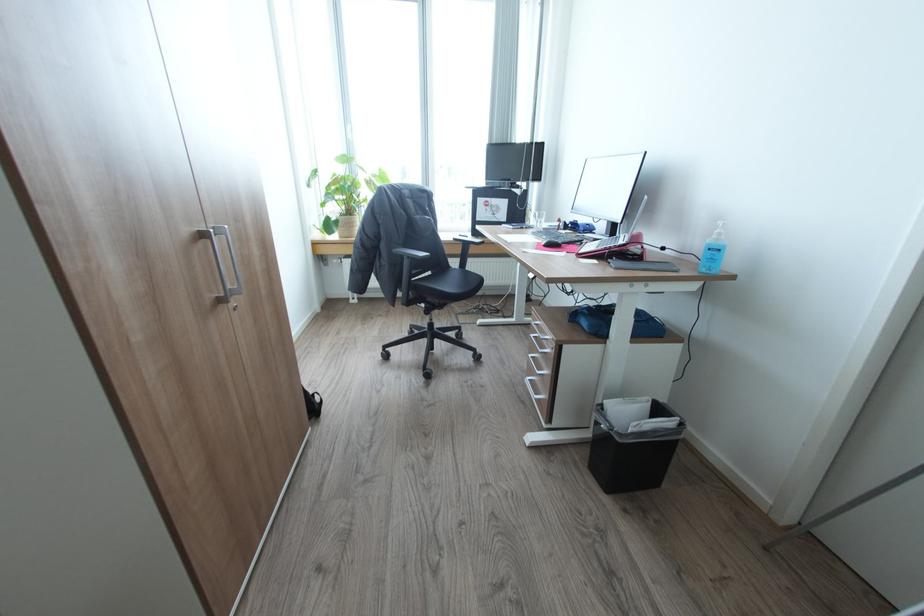
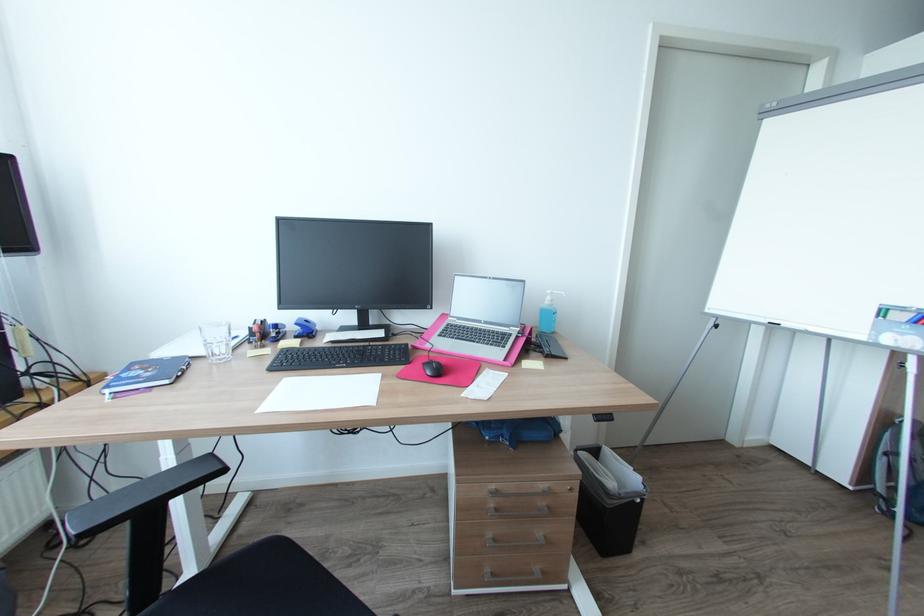
The point at (517, 227) is marked in the first image. Where is the corresponding point in the second image?

(171, 381)